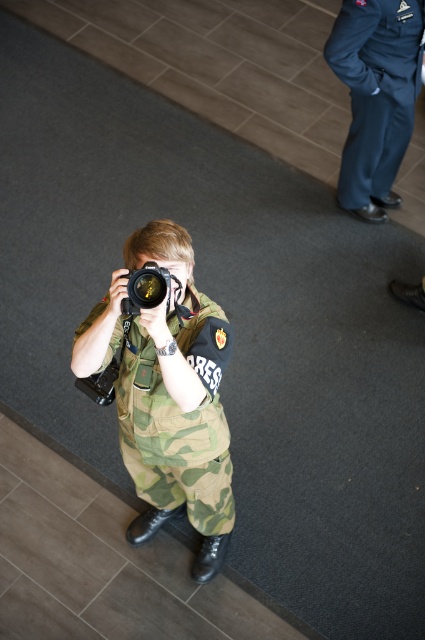
Question: Does camo fabric uniform at center have a lesser width compared to navy blue fabric pants at upper right?

Choices:
 (A) no
 (B) yes

Answer: (B)

Question: Based on their relative distances, which object is farther from the navy blue fabric pants at upper right?

Choices:
 (A) camo fabric uniform at center
 (B) black plastic camera at center

Answer: (A)

Question: Which point is closer to the camera?

Choices:
 (A) (136, 365)
 (B) (141, 268)

Answer: (B)

Question: Is navy blue fabric pants at upper right further to camera compared to black plastic camera at center?

Choices:
 (A) yes
 (B) no

Answer: (A)

Question: Based on their relative distances, which object is nearer to the black plastic camera at center?

Choices:
 (A) navy blue fabric pants at upper right
 (B) camo fabric uniform at center

Answer: (B)

Question: Observing the image, what is the correct spatial positioning of camo fabric uniform at center in reference to black plastic camera at center?

Choices:
 (A) above
 (B) below

Answer: (B)